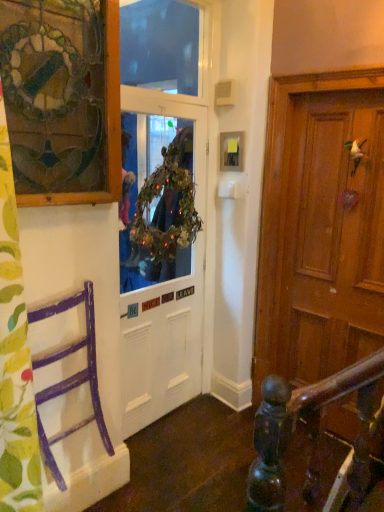
Locate an element on the screen. This screenshot has height=512, width=384. wooden picture frame at upper center, which ranks as the 1th picture frame in right-to-left order is located at coordinates (232, 151).

Describe the element at coordinates (162, 46) in the screenshot. I see `transparent plastic window screen at upper center, the second window screen positioned from the bottom` at that location.

Measure the distance between purple painted wood chair at left and camera.

purple painted wood chair at left and camera are 1.62 meters apart from each other.

The width and height of the screenshot is (384, 512). What do you see at coordinates (159, 222) in the screenshot? I see `green leafy wreath at center, the first window screen ordered from the bottom` at bounding box center [159, 222].

What are the coordinates of `white matte door at center` in the screenshot? It's located at (161, 335).

Image resolution: width=384 pixels, height=512 pixels. In order to click on wooden picture frame at upper center, which ranks as the 1th picture frame in right-to-left order in this screenshot , I will do `click(232, 151)`.

Does green leafy fabric at left turn towards green leafy wreath at center, marked as the second window screen in a top-to-bottom arrangement?

No, green leafy fabric at left does not turn towards green leafy wreath at center, marked as the second window screen in a top-to-bottom arrangement.

Is green leafy fabric at left bigger than green leafy wreath at center, marked as the second window screen in a top-to-bottom arrangement?

Correct, green leafy fabric at left is larger in size than green leafy wreath at center, marked as the second window screen in a top-to-bottom arrangement.

Is green leafy fabric at left to the right of green leafy wreath at center, marked as the second window screen in a top-to-bottom arrangement, from the viewer's perspective?

In fact, green leafy fabric at left is to the left of green leafy wreath at center, marked as the second window screen in a top-to-bottom arrangement.

Is green leafy fabric at left inside or outside of green leafy wreath at center, marked as the second window screen in a top-to-bottom arrangement?

green leafy fabric at left exists outside the volume of green leafy wreath at center, marked as the second window screen in a top-to-bottom arrangement.

Between green leafy fabric at left and purple painted wood chair at left, which one has less height?

Standing shorter between the two is purple painted wood chair at left.

Can we say green leafy fabric at left lies outside purple painted wood chair at left?

Yes, green leafy fabric at left is not within purple painted wood chair at left.

Considering the sizes of objects green leafy fabric at left and purple painted wood chair at left in the image provided, who is smaller, green leafy fabric at left or purple painted wood chair at left?

purple painted wood chair at left.

Consider the image. Relative to purple painted wood chair at left, is green leafy fabric at left in front or behind?

Clearly, green leafy fabric at left is in front of purple painted wood chair at left.

Is point (86, 319) closer to viewer compared to point (72, 33)?

No, (86, 319) is behind (72, 33).

From a real-world perspective, which is physically above, purple painted wood chair at left or stained glass window at upper left, which is the 1th picture frame from left to right?

stained glass window at upper left, which is the 1th picture frame from left to right, is physically above.

Between purple painted wood chair at left and stained glass window at upper left, the 2th picture frame in the back-to-front sequence, which one appears on the left side from the viewer's perspective?

Positioned to the left is purple painted wood chair at left.

From the image's perspective, who appears lower, purple painted wood chair at left or stained glass window at upper left, which is the 1th picture frame from left to right?

purple painted wood chair at left is shown below in the image.

Does wooden picture frame at upper center, the 1th picture frame in the back-to-front sequence, have a greater width compared to green leafy fabric at left?

Incorrect, the width of wooden picture frame at upper center, the 1th picture frame in the back-to-front sequence, does not surpass that of green leafy fabric at left.

From a real-world perspective, is wooden picture frame at upper center, which ranks as the 1th picture frame in right-to-left order, physically above green leafy fabric at left?

Yes, from a real-world perspective, wooden picture frame at upper center, which ranks as the 1th picture frame in right-to-left order, is on top of green leafy fabric at left.

In the scene shown: Considering the sizes of wooden picture frame at upper center, which is counted as the second picture frame, starting from the front, and green leafy fabric at left in the image, is wooden picture frame at upper center, which is counted as the second picture frame, starting from the front, bigger or smaller than green leafy fabric at left?

In the image, wooden picture frame at upper center, which is counted as the second picture frame, starting from the front, appears to be smaller than green leafy fabric at left.

The image size is (384, 512). What are the coordinates of `picture frame that is the 2nd object to the right of the green leafy fabric at left, starting at the anchor` in the screenshot? It's located at (232, 151).

Is transparent plastic window screen at upper center, which is the first window screen from top to bottom, bigger or smaller than wooden picture frame at upper center, the 1th picture frame in the back-to-front sequence?

In the image, transparent plastic window screen at upper center, which is the first window screen from top to bottom, appears to be larger than wooden picture frame at upper center, the 1th picture frame in the back-to-front sequence.

Which object is positioned more to the right, transparent plastic window screen at upper center, the second window screen positioned from the bottom, or wooden picture frame at upper center, the 1th picture frame in the back-to-front sequence?

Positioned to the right is wooden picture frame at upper center, the 1th picture frame in the back-to-front sequence.

Is the position of transparent plastic window screen at upper center, the second window screen positioned from the bottom, less distant than that of wooden picture frame at upper center, the 1th picture frame in the back-to-front sequence?

Yes, it is in front of wooden picture frame at upper center, the 1th picture frame in the back-to-front sequence.

Which is correct: transparent plastic window screen at upper center, the second window screen positioned from the bottom, is inside wooden picture frame at upper center, which is counted as the second picture frame, starting from the front, or outside of it?

transparent plastic window screen at upper center, the second window screen positioned from the bottom, is located beyond the bounds of wooden picture frame at upper center, which is counted as the second picture frame, starting from the front.

Between transparent plastic window screen at upper center, which is the first window screen from top to bottom, and purple painted wood chair at left, which one has larger size?

purple painted wood chair at left is bigger.

From the picture: What's the angular difference between transparent plastic window screen at upper center, the second window screen positioned from the bottom, and purple painted wood chair at left's facing directions?

transparent plastic window screen at upper center, the second window screen positioned from the bottom, and purple painted wood chair at left are facing 4.21 degrees away from each other.

Could you measure the distance between transparent plastic window screen at upper center, which is the first window screen from top to bottom, and purple painted wood chair at left?

transparent plastic window screen at upper center, which is the first window screen from top to bottom, is 6.36 feet from purple painted wood chair at left.

Starting from the purple painted wood chair at left, which window screen is the 1st one behind? Please provide its 2D coordinates.

[(162, 46)]

Is stained glass window at upper left, placed as the 1th picture frame when sorted from front to back, positioned with its back to transparent plastic window screen at upper center, the second window screen positioned from the bottom?

No.

From a real-world perspective, between stained glass window at upper left, the second picture frame in the right-to-left sequence, and transparent plastic window screen at upper center, which is the first window screen from top to bottom, who is vertically higher?

transparent plastic window screen at upper center, which is the first window screen from top to bottom, from a real-world perspective.

Based on the photo, between stained glass window at upper left, the 2th picture frame in the back-to-front sequence, and transparent plastic window screen at upper center, which is the first window screen from top to bottom, which one has larger size?

stained glass window at upper left, the 2th picture frame in the back-to-front sequence, is bigger.

Does stained glass window at upper left, the 2th picture frame in the back-to-front sequence, contain transparent plastic window screen at upper center, which is the first window screen from top to bottom?

No.

Locate an element on the screen. curtain that is under the green leafy wreath at center, the first window screen ordered from the bottom (from a real-world perspective) is located at coordinates (15, 358).

Locate an element on the screen. This screenshot has width=384, height=512. chair that is on the right side of green leafy fabric at left is located at coordinates (70, 376).

Based on their spatial positions, is wooden picture frame at upper center, which is counted as the second picture frame, starting from the front, or stained glass window at upper left, the second picture frame in the right-to-left sequence, further from purple painted wood chair at left?

The object further to purple painted wood chair at left is wooden picture frame at upper center, which is counted as the second picture frame, starting from the front.

Looking at the image, which one is located further to green leafy fabric at left, wooden picture frame at upper center, the 1th picture frame in the back-to-front sequence, or green leafy wreath at center, the first window screen ordered from the bottom?

Among the two, wooden picture frame at upper center, the 1th picture frame in the back-to-front sequence, is located further to green leafy fabric at left.

Estimate the real-world distances between objects in this image. Which object is further from purple painted wood chair at left, stained glass window at upper left, which is the 1th picture frame from left to right, or wooden picture frame at upper center, which is counted as the second picture frame, starting from the front?

Among the two, wooden picture frame at upper center, which is counted as the second picture frame, starting from the front, is located further to purple painted wood chair at left.

When comparing their distances from green leafy wreath at center, the first window screen ordered from the bottom, does purple painted wood chair at left or stained glass window at upper left, placed as the 1th picture frame when sorted from front to back, seem closer?

The object closer to green leafy wreath at center, the first window screen ordered from the bottom, is stained glass window at upper left, placed as the 1th picture frame when sorted from front to back.

Estimate the real-world distances between objects in this image. Which object is closer to stained glass window at upper left, which is the 1th picture frame from left to right, wooden picture frame at upper center, the 1th picture frame in the back-to-front sequence, or transparent plastic window screen at upper center, which is the first window screen from top to bottom?

Based on the image, wooden picture frame at upper center, the 1th picture frame in the back-to-front sequence, appears to be nearer to stained glass window at upper left, which is the 1th picture frame from left to right.

Considering their positions, is purple painted wood chair at left positioned closer to green leafy fabric at left than transparent plastic window screen at upper center, the second window screen positioned from the bottom?

Among the two, purple painted wood chair at left is located nearer to green leafy fabric at left.

Based on their spatial positions, is green leafy wreath at center, marked as the second window screen in a top-to-bottom arrangement, or stained glass window at upper left, the 2th picture frame in the back-to-front sequence, closer to transparent plastic window screen at upper center, which is the first window screen from top to bottom?

green leafy wreath at center, marked as the second window screen in a top-to-bottom arrangement, is closer to transparent plastic window screen at upper center, which is the first window screen from top to bottom.

Consider the image. Which object lies nearer to the anchor point green leafy wreath at center, the first window screen ordered from the bottom, purple painted wood chair at left or white matte door at center?

white matte door at center lies closer to green leafy wreath at center, the first window screen ordered from the bottom, than the other object.

Image resolution: width=384 pixels, height=512 pixels. Identify the location of curtain between green leafy wreath at center, marked as the second window screen in a top-to-bottom arrangement, and purple painted wood chair at left from top to bottom. (15, 358).

Identify the location of picture frame between green leafy fabric at left and green leafy wreath at center, marked as the second window screen in a top-to-bottom arrangement, in the front-back direction. This screenshot has width=384, height=512. [x=62, y=99].

The image size is (384, 512). Find the location of `window screen located between stained glass window at upper left, placed as the 1th picture frame when sorted from front to back, and green leafy wreath at center, the first window screen ordered from the bottom, in the depth direction`. window screen located between stained glass window at upper left, placed as the 1th picture frame when sorted from front to back, and green leafy wreath at center, the first window screen ordered from the bottom, in the depth direction is located at coordinates (162, 46).

Locate an element on the screen. The width and height of the screenshot is (384, 512). window screen between transparent plastic window screen at upper center, which is the first window screen from top to bottom, and purple painted wood chair at left vertically is located at coordinates (159, 222).